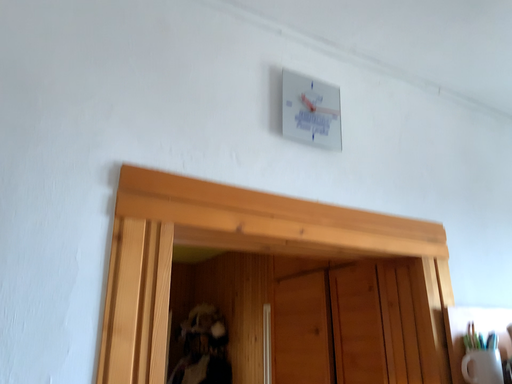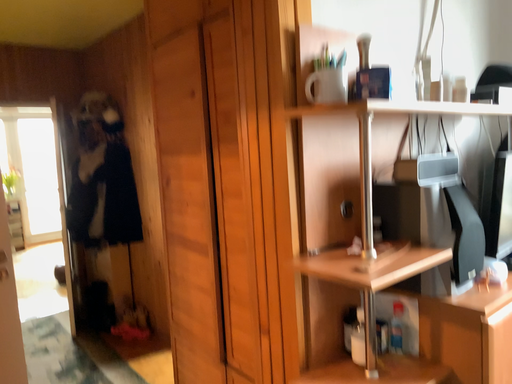
Question: How did the camera likely rotate when shooting the video?

Choices:
 (A) rotated left
 (B) rotated right

Answer: (B)